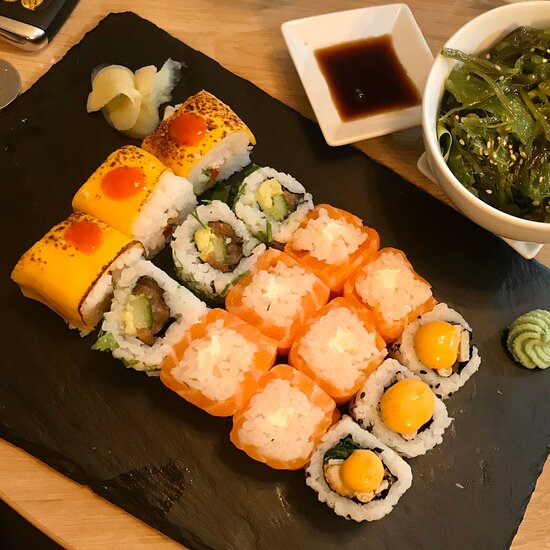
The width and height of the screenshot is (550, 550). In order to click on bowl of soy sauce in this screenshot , I will do `click(337, 60)`.